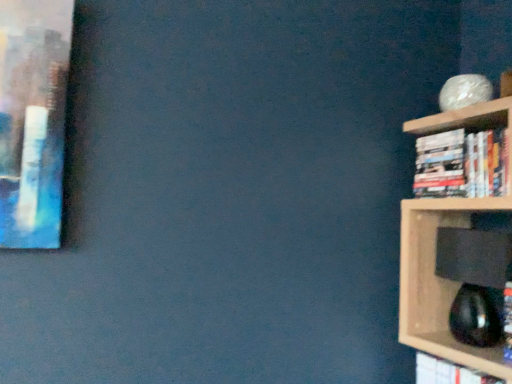
Question: Does point (450, 382) appear closer or farther from the camera than point (416, 192)?

Choices:
 (A) farther
 (B) closer

Answer: (B)

Question: From a real-world perspective, relative to hardcover books at right, the second book ordered from the bottom, is hardcover book at right, which appears as the second book when viewed from the top, vertically above or below?

Choices:
 (A) below
 (B) above

Answer: (A)

Question: Is hardcover book at right, which appears as the second book when viewed from the top, taller or shorter than hardcover books at right, the second book ordered from the bottom?

Choices:
 (A) tall
 (B) short

Answer: (B)

Question: Is point (480, 152) positioned closer to the camera than point (415, 380)?

Choices:
 (A) closer
 (B) farther

Answer: (A)

Question: Is hardcover books at right, the 1th book when ordered from top to bottom, wider or thinner than hardcover book at right, which is counted as the 1th book, starting from the bottom?

Choices:
 (A) thin
 (B) wide

Answer: (B)

Question: From the image's perspective, is hardcover books at right, the second book ordered from the bottom, positioned above or below hardcover book at right, which is counted as the 1th book, starting from the bottom?

Choices:
 (A) above
 (B) below

Answer: (A)

Question: Considering the positions of hardcover books at right, the 1th book when ordered from top to bottom, and hardcover book at right, which appears as the second book when viewed from the top, in the image, is hardcover books at right, the 1th book when ordered from top to bottom, bigger or smaller than hardcover book at right, which appears as the second book when viewed from the top,?

Choices:
 (A) small
 (B) big

Answer: (B)